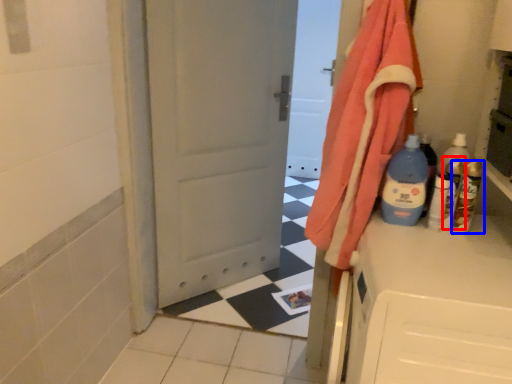
Question: Which object is further to the camera taking this photo, bottle (highlighted by a red box) or bottle (highlighted by a blue box)?

Choices:
 (A) bottle
 (B) bottle

Answer: (A)